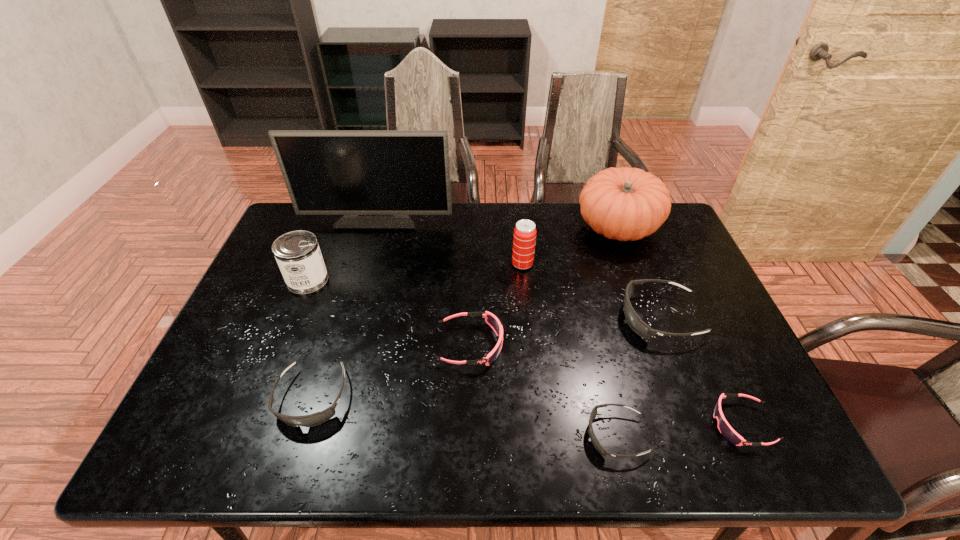
This screenshot has height=540, width=960. I want to click on vacant space at the near left corner, so click(212, 442).

The image size is (960, 540). I want to click on free spot at the far right corner of the desktop, so click(x=636, y=245).

Where is `vacant region at the near right corner of the desktop`? vacant region at the near right corner of the desktop is located at coordinates (716, 448).

The width and height of the screenshot is (960, 540). I want to click on vacant area that lies between the bigger pink goggles and the smaller pink goggles, so click(606, 384).

Where is `free point between the farther pink goggles and the smaller pink goggles`? The height and width of the screenshot is (540, 960). free point between the farther pink goggles and the smaller pink goggles is located at coordinates (606, 384).

Where is `free spot between the leftmost goggles and the farther pink goggles`? The width and height of the screenshot is (960, 540). free spot between the leftmost goggles and the farther pink goggles is located at coordinates (391, 371).

This screenshot has height=540, width=960. In order to click on vacant space that is in between the leftmost goggles and the can in this screenshot , I will do `click(310, 339)`.

The width and height of the screenshot is (960, 540). Identify the location of empty space between the bigger pink goggles and the second black goggles from left to right. (543, 390).

At what (x,y) coordinates should I click in order to perform the action: click on vacant area that lies between the can and the second smallest black goggles. Please return your answer as a coordinate pair (x, y). The width and height of the screenshot is (960, 540). Looking at the image, I should click on 310,339.

Where is `free space between the right pink goggles and the black monitor`? free space between the right pink goggles and the black monitor is located at coordinates (560, 321).